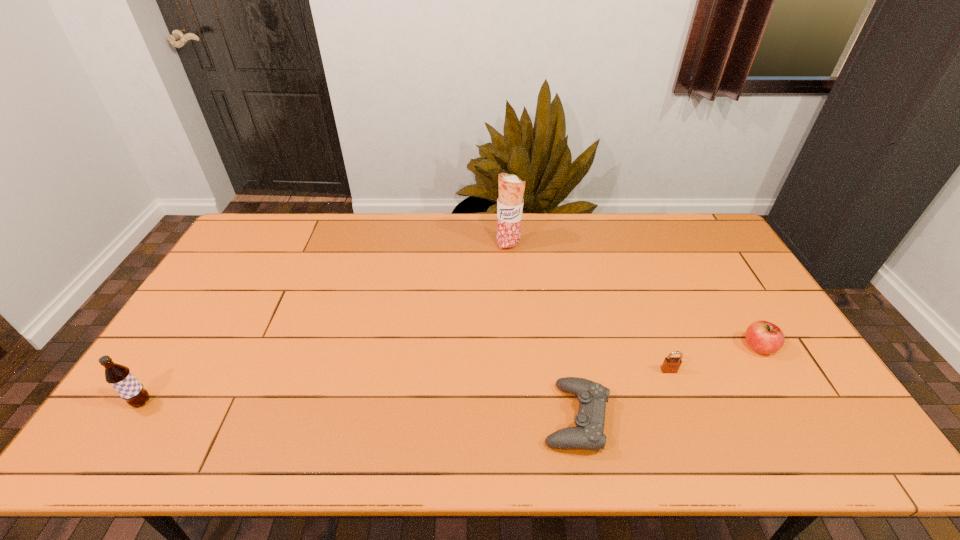
In the image, there is a desktop. At what (x,y) coordinates should I click in order to perform the action: click on vacant space at the near edge. Please return your answer as a coordinate pair (x, y). Looking at the image, I should click on (524, 442).

Image resolution: width=960 pixels, height=540 pixels. In the image, there is a desktop. Find the location of `free space at the left edge`. free space at the left edge is located at coordinates (194, 374).

What are the coordinates of `vacant space at the far left corner` in the screenshot? It's located at (259, 249).

I want to click on vacant space that's between the control and the farthest object, so click(542, 331).

Image resolution: width=960 pixels, height=540 pixels. In order to click on free space between the tallest object and the root beer in this screenshot , I will do `click(325, 323)`.

At what (x,y) coordinates should I click in order to perform the action: click on free space between the second object from left to right and the third object from right to left. Please return your answer as a coordinate pair (x, y). This screenshot has width=960, height=540. Looking at the image, I should click on (542, 331).

Where is `vacant space in between the control and the padlock`? vacant space in between the control and the padlock is located at coordinates (622, 394).

The width and height of the screenshot is (960, 540). I want to click on vacant space that is in between the padlock and the second farthest object, so click(713, 359).

The image size is (960, 540). Identify the location of free area in between the second farthest object and the root beer. (450, 375).

Find the location of a particular element. free spot between the second farthest object and the shortest object is located at coordinates (667, 382).